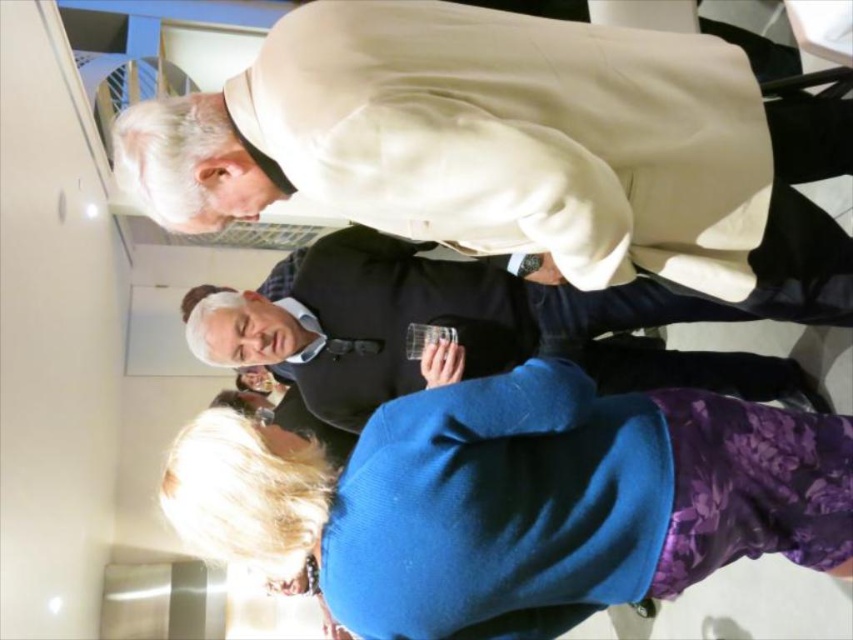
Can you confirm if light beige fabric coat at upper center is thinner than matte black vest at center?

Yes, light beige fabric coat at upper center is thinner than matte black vest at center.

Locate an element on the screen. light beige fabric coat at upper center is located at coordinates (515, 148).

Does point (518, 243) lie in front of point (804, 376)?

Yes, point (518, 243) is closer to viewer.

You are a GUI agent. You are given a task and a screenshot of the screen. Output one action in this format:
    pyautogui.click(x=<x>, y=<y>)
    Task: Click on the light beige fabric coat at upper center
    The height and width of the screenshot is (640, 853).
    Given the screenshot: What is the action you would take?
    pyautogui.click(x=515, y=148)

Which of these two, blue woolen sweater at lower center or matte black vest at center, stands taller?

matte black vest at center is taller.

Is point (758, 486) closer to viewer compared to point (495, 285)?

Yes, it is in front of point (495, 285).

Identify the location of blue woolen sweater at lower center. (514, 499).

Is light beige fabric coat at upper center further to the viewer compared to blue woolen sweater at lower center?

That is False.

Between light beige fabric coat at upper center and blue woolen sweater at lower center, which one appears on the right side from the viewer's perspective?

blue woolen sweater at lower center is more to the right.

At what (x,y) coordinates should I click in order to perform the action: click on light beige fabric coat at upper center. Please return your answer as a coordinate pair (x, y). Looking at the image, I should click on (515, 148).

This screenshot has width=853, height=640. In order to click on light beige fabric coat at upper center in this screenshot , I will do `click(515, 148)`.